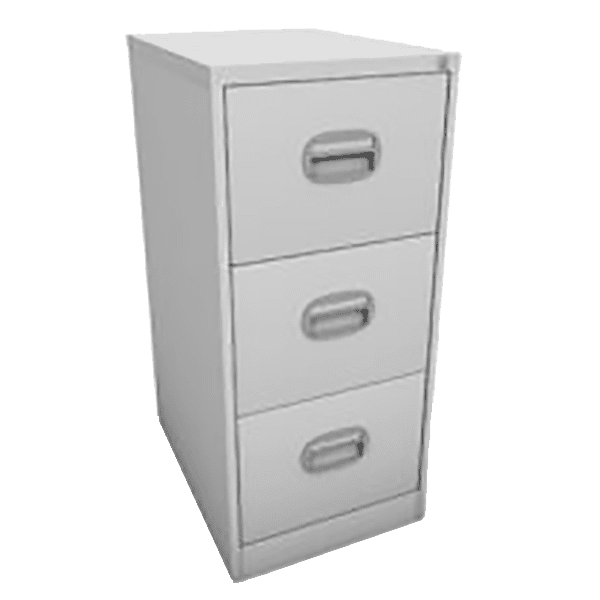
Locate an element on the screen. This screenshot has width=600, height=600. silver drawer handles is located at coordinates (347, 152), (332, 301), (343, 438).